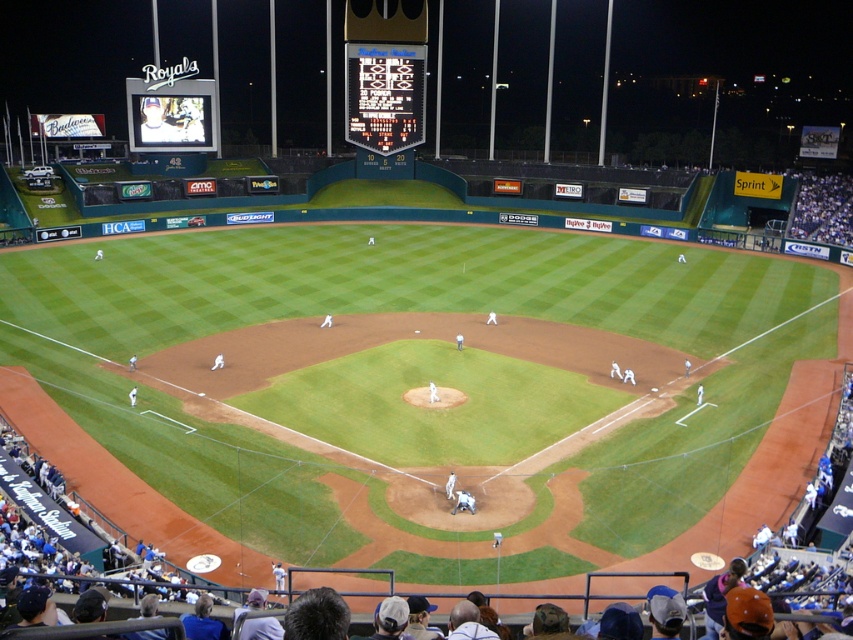
Which is in front, point (407, 100) or point (163, 81)?

Point (163, 81) is more forward.

Does black digital scoreboard at upper center appear over matte black scoreboard at upper left?

Indeed, black digital scoreboard at upper center is positioned over matte black scoreboard at upper left.

Is point (395, 90) less distant than point (149, 131)?

That is False.

The width and height of the screenshot is (853, 640). Find the location of `black digital scoreboard at upper center`. black digital scoreboard at upper center is located at coordinates (384, 96).